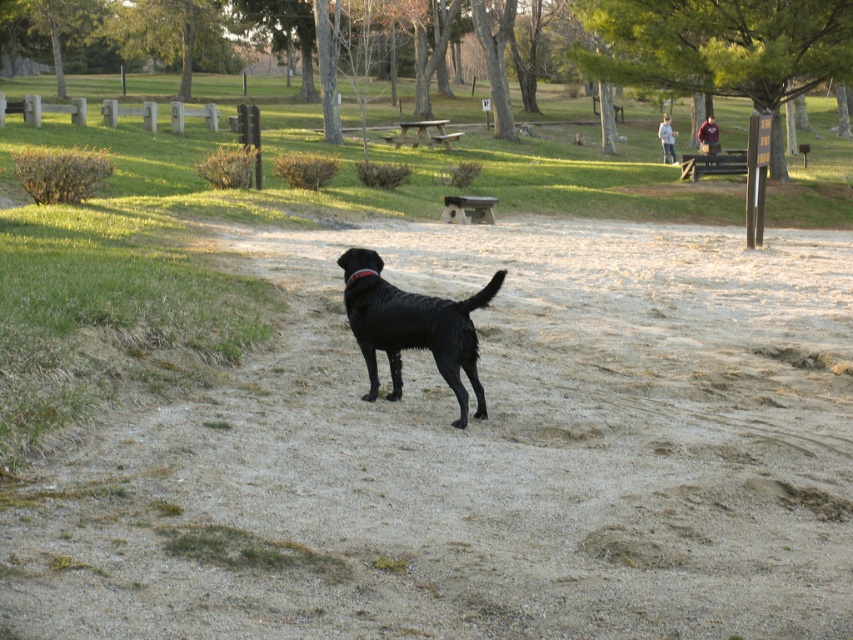
Is sandy textured dog at center positioned in front of shiny black dog at center?

That is True.

Can you confirm if sandy textured dog at center is positioned to the right of shiny black dog at center?

Indeed, sandy textured dog at center is positioned on the right side of shiny black dog at center.

This screenshot has width=853, height=640. Identify the location of sandy textured dog at center. (485, 454).

Locate an element on the screen. sandy textured dog at center is located at coordinates (485, 454).